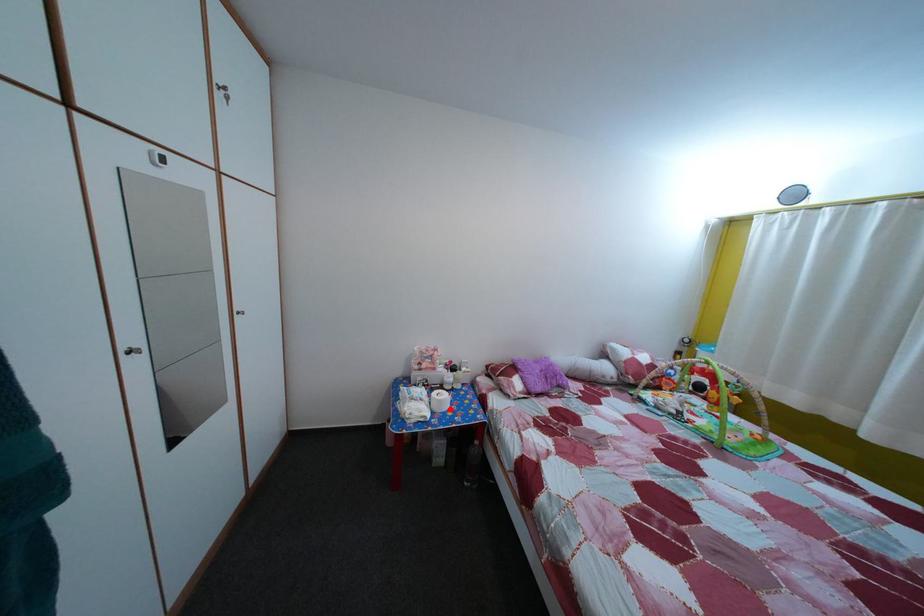
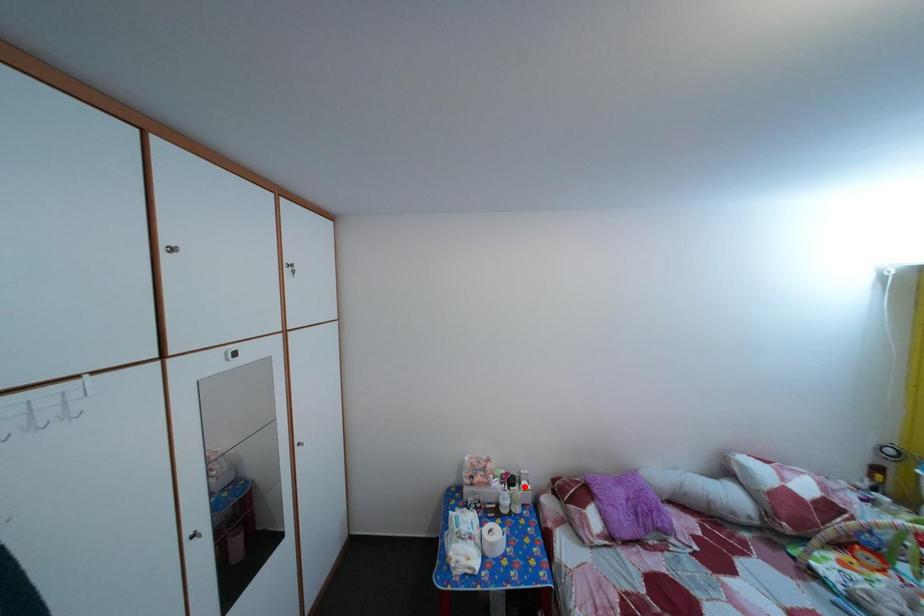
I am providing you with two images of the same scene from different viewpoints. A red point is marked on the first image and another point is marked on the second image. Are the points marked in image1 and image2 representing the same 3D position?

No